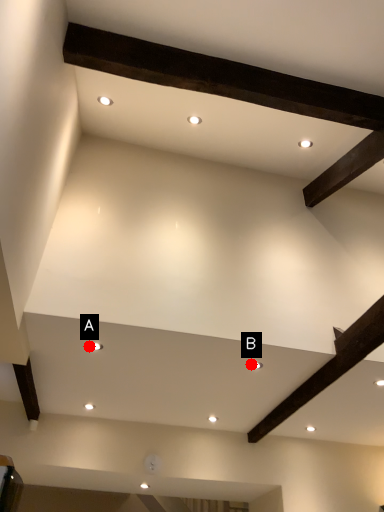
Question: Two points are circled on the image, labeled by A and B beside each circle. Which point is further to the camera?

Choices:
 (A) A is further
 (B) B is further

Answer: (B)